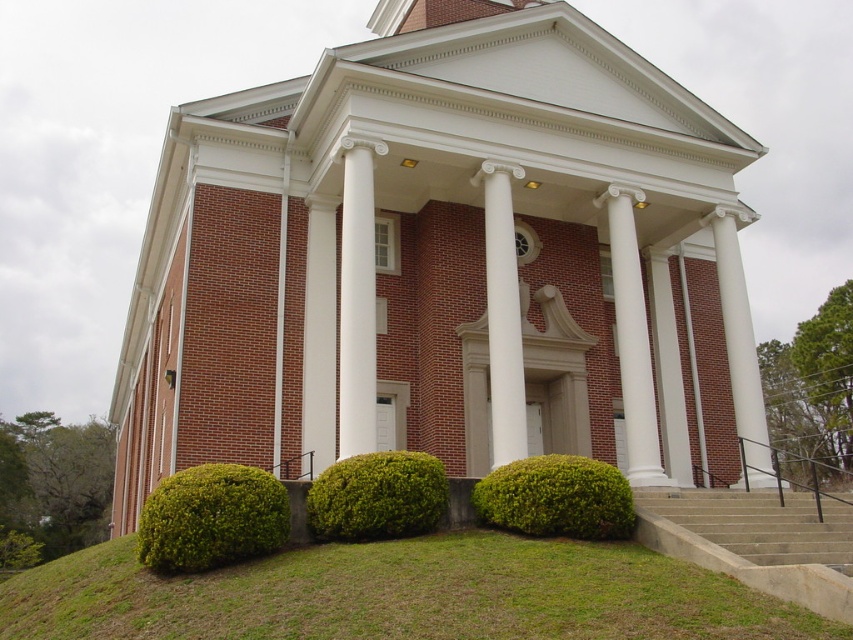
Looking at this image, can you confirm if concrete stairs at lower right is taller than green leafy bush at lower center?

In fact, concrete stairs at lower right may be shorter than green leafy bush at lower center.

Does point (785, 552) come in front of point (492, 483)?

Yes, point (785, 552) is closer to viewer.

Where is `concrete stairs at lower right`? concrete stairs at lower right is located at coordinates (759, 524).

Which is more to the left, concrete stairs at lower right or green leafy hedge at lower center?

Positioned to the left is green leafy hedge at lower center.

Who is positioned more to the right, concrete stairs at lower right or green leafy hedge at lower center?

Positioned to the right is concrete stairs at lower right.

This screenshot has width=853, height=640. What do you see at coordinates (759, 524) in the screenshot? I see `concrete stairs at lower right` at bounding box center [759, 524].

Identify the location of concrete stairs at lower right. (759, 524).

Who is lower down, green grass at lower center or green leafy bush at lower left?

green grass at lower center is lower down.

Is green grass at lower center wider than green leafy bush at lower left?

Yes.

Which is behind, point (105, 541) or point (183, 572)?

Point (105, 541)

What are the coordinates of `green grass at lower center` in the screenshot? It's located at (402, 595).